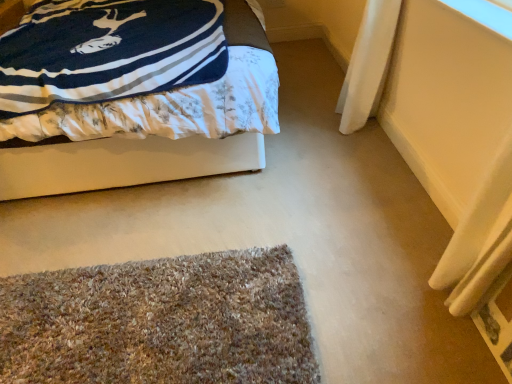
You are a GUI agent. You are given a task and a screenshot of the screen. Output one action in this format:
    pyautogui.click(x=<x>, y=<y>)
    Task: Click on the vacant area that lies between velvet-like blue blanket at upper left and multicolored shaggy mat at lower center
    The height and width of the screenshot is (384, 512).
    Given the screenshot: What is the action you would take?
    159,235